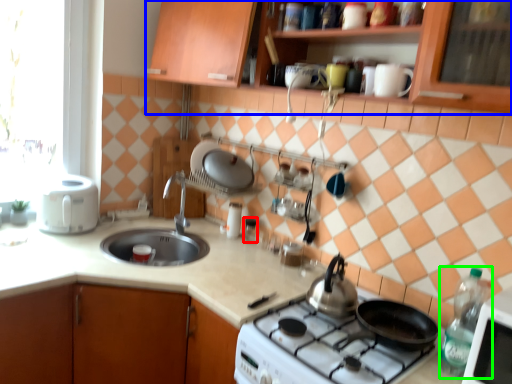
Question: Considering the real-world distances, which object is closest to appliance (highlighted by a red box)? cabinetry (highlighted by a blue box) or kitchen appliance (highlighted by a green box).

Choices:
 (A) cabinetry
 (B) kitchen appliance

Answer: (A)